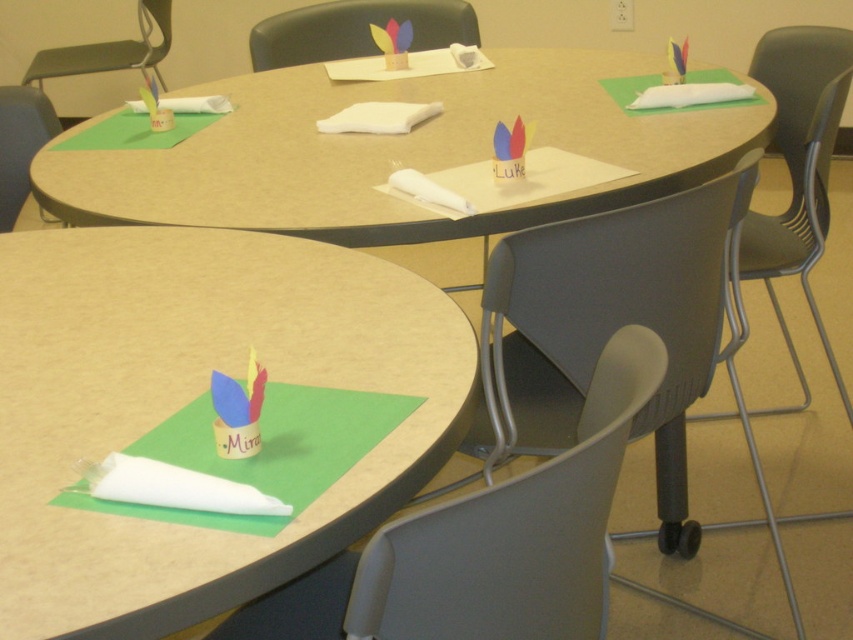
Question: Which point is farther from the camera taking this photo?

Choices:
 (A) (4, 198)
 (B) (485, 323)

Answer: (A)

Question: Estimate the real-world distances between objects in this image. Which object is farther from the matte plastic chair at upper center?

Choices:
 (A) gray plastic chair at center
 (B) matte cardboard table at center
 (C) matte plastic chair at left
 (D) matte cardboard hat at center

Answer: (D)

Question: Does matte cardboard table at center have a smaller size compared to metallic gray chair at upper left?

Choices:
 (A) no
 (B) yes

Answer: (A)

Question: Can you confirm if matte cardboard hat at center is positioned above matte plastic chair at upper center?

Choices:
 (A) no
 (B) yes

Answer: (A)

Question: Estimate the real-world distances between objects in this image. Which object is closer to the matte cardboard hat at center?

Choices:
 (A) gray plastic chair at center
 (B) matte cardboard table at center

Answer: (A)

Question: Can you confirm if matte plastic chair at upper center is positioned below matte blue paper cup at lower left?

Choices:
 (A) no
 (B) yes

Answer: (A)